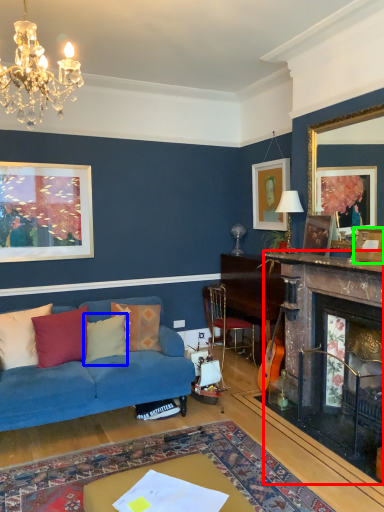
Question: Estimate the real-world distances between objects in this image. Which object is closer to fireplace (highlighted by a red box), pillow (highlighted by a blue box) or picture frame (highlighted by a green box)?

Choices:
 (A) pillow
 (B) picture frame

Answer: (B)